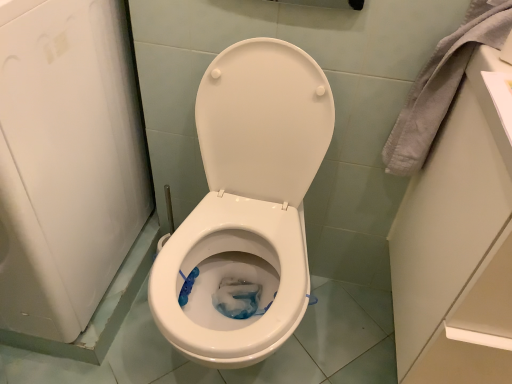
Question: From a real-world perspective, is gray fabric towel at upper right above or below white glossy toilet at center?

Choices:
 (A) above
 (B) below

Answer: (A)

Question: Looking at the image, does gray fabric towel at upper right seem bigger or smaller compared to white glossy toilet at center?

Choices:
 (A) small
 (B) big

Answer: (A)

Question: From the image's perspective, is gray fabric towel at upper right above or below white glossy toilet at center?

Choices:
 (A) above
 (B) below

Answer: (A)

Question: From their relative heights in the image, would you say white glossy toilet at center is taller or shorter than gray fabric towel at upper right?

Choices:
 (A) tall
 (B) short

Answer: (A)

Question: Is white glossy toilet at center in front of or behind gray fabric towel at upper right in the image?

Choices:
 (A) behind
 (B) front

Answer: (B)

Question: From the image's perspective, is white glossy toilet at center positioned above or below gray fabric towel at upper right?

Choices:
 (A) below
 (B) above

Answer: (A)

Question: Does point (231, 266) appear closer or farther from the camera than point (481, 18)?

Choices:
 (A) farther
 (B) closer

Answer: (A)